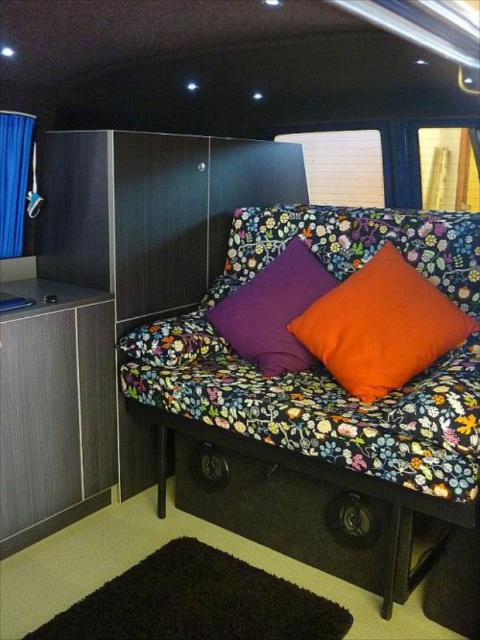
You are a photographer who needs to position your camera exactly 5 feet away from the floral fabric couch at center. Can you place your camera at the correct distance?

The floral fabric couch at center and camera are 5.01 feet apart, so yes, you can place the camera at the correct distance since it is just slightly over 5 feet away.

You are organizing a small camping trip and need to know which pillow to use for better support. The orange fabric pillow at center and the purple fabric pillow at center are both available. Which one is taller?

The orange fabric pillow at center is taller than the purple fabric pillow at center, so it would provide better support.